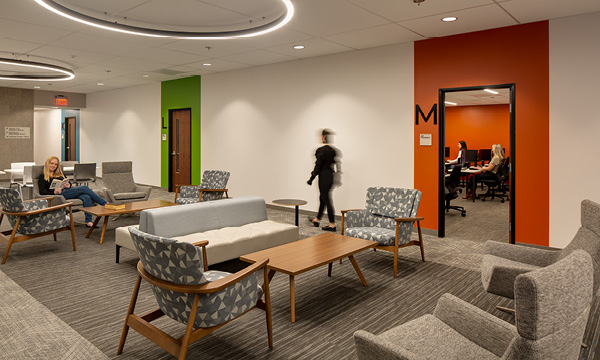
The width and height of the screenshot is (600, 360). What are the coordinates of `4 chairs with wooden frame and patterned fabric` in the screenshot? It's located at (179, 259), (397, 204), (215, 180), (32, 203).